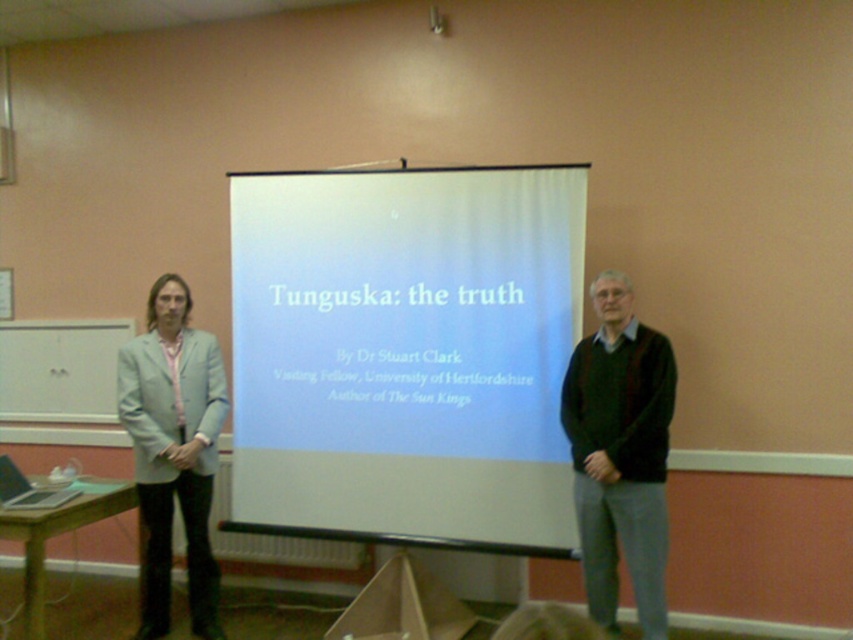
Is point (428, 356) more distant than point (624, 387)?

That is True.

Can you confirm if white matte projection screen at center is wider than dark green sweater at center?

Correct, the width of white matte projection screen at center exceeds that of dark green sweater at center.

Which is behind, point (380, 209) or point (653, 612)?

The point (380, 209) is more distant.

The image size is (853, 640). Identify the location of white matte projection screen at center. (405, 353).

Can you confirm if white matte projection screen at center is shorter than light blue fabric jacket at left?

Yes, white matte projection screen at center is shorter than light blue fabric jacket at left.

Can you confirm if white matte projection screen at center is positioned to the right of light blue fabric jacket at left?

Correct, you'll find white matte projection screen at center to the right of light blue fabric jacket at left.

The image size is (853, 640). I want to click on white matte projection screen at center, so click(x=405, y=353).

How far apart are dark green sweater at center and light blue fabric jacket at left?

A distance of 1.78 meters exists between dark green sweater at center and light blue fabric jacket at left.

This screenshot has width=853, height=640. What do you see at coordinates (619, 452) in the screenshot?
I see `dark green sweater at center` at bounding box center [619, 452].

Is point (579, 516) behind point (160, 538)?

No, it is not.

Image resolution: width=853 pixels, height=640 pixels. What are the coordinates of `dark green sweater at center` in the screenshot? It's located at (619, 452).